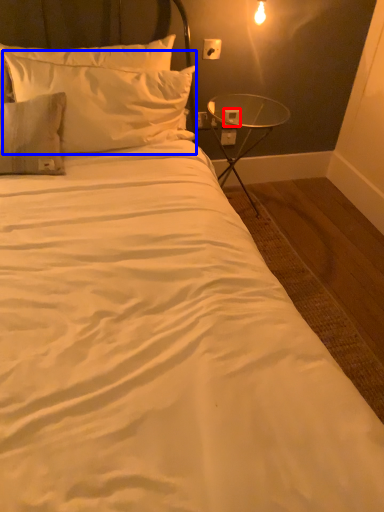
Question: Which object is further to the camera taking this photo, electric outlet (highlighted by a red box) or pillow (highlighted by a blue box)?

Choices:
 (A) electric outlet
 (B) pillow

Answer: (A)